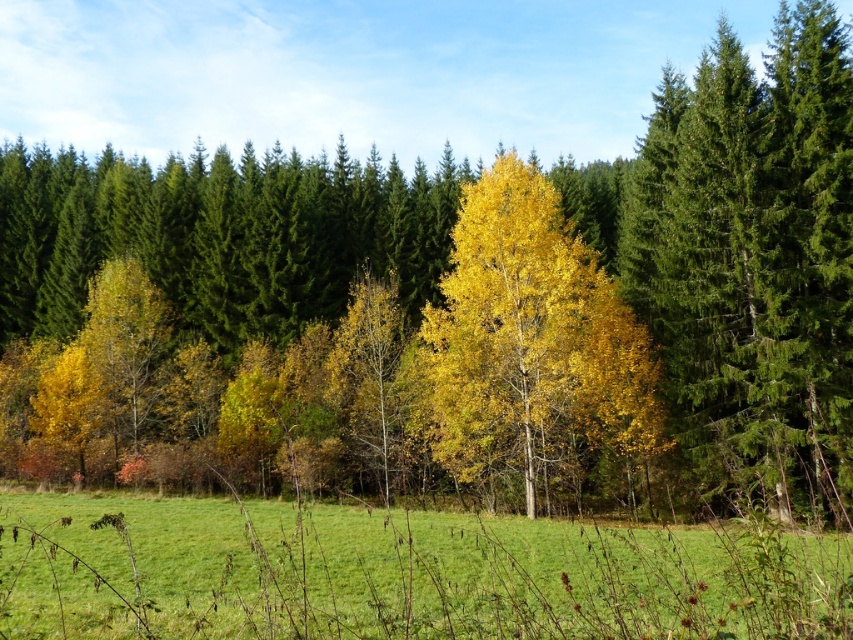
Which is in front, point (329, 573) or point (459, 480)?

Point (329, 573) is in front.

Where is `green grass at center`? The image size is (853, 640). green grass at center is located at coordinates (401, 573).